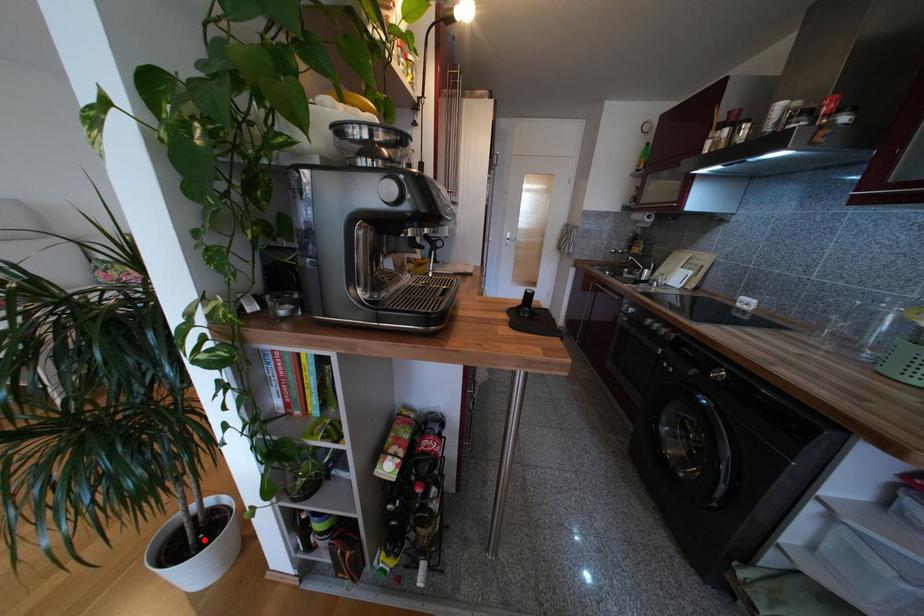
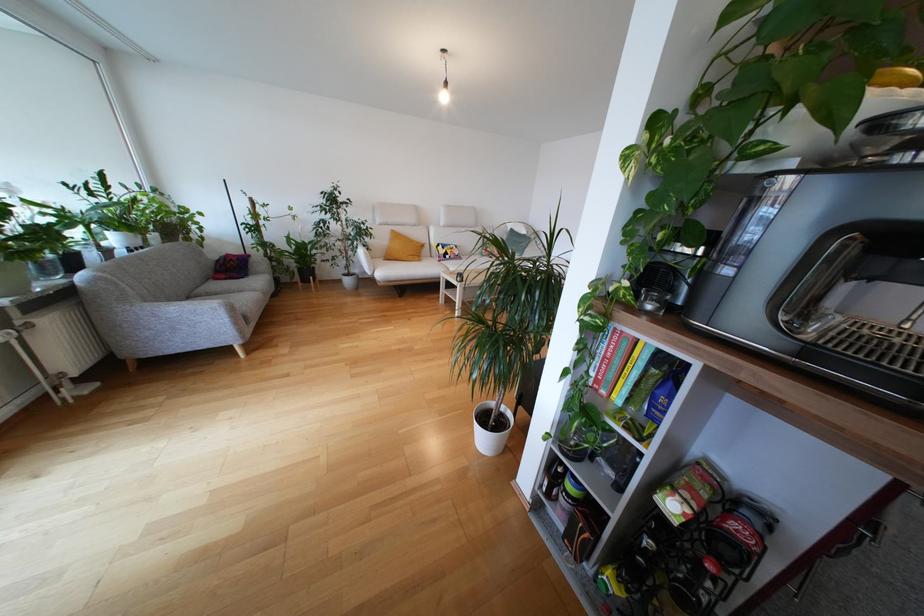
Question: I am providing you with two images of the same scene from different viewpoints. A red point is shown in image1. For the corresponding object point in image2, is it positioned nearer or farther from the camera?

Choices:
 (A) Nearer
 (B) Farther

Answer: (B)